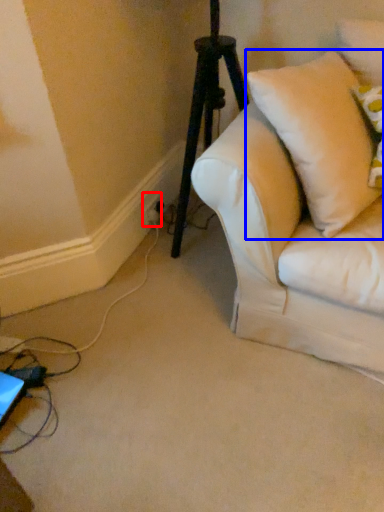
Question: Which object appears farthest to the camera in this image, electric outlet (highlighted by a red box) or pillow (highlighted by a blue box)?

Choices:
 (A) electric outlet
 (B) pillow

Answer: (A)